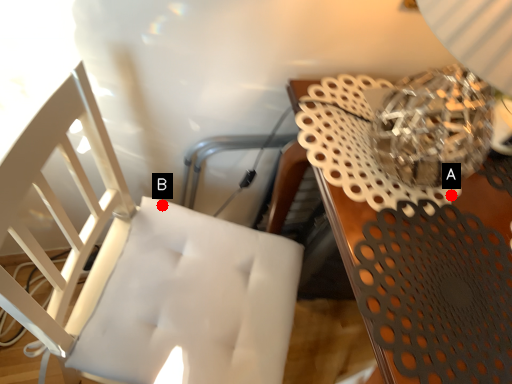
Question: Two points are circled on the image, labeled by A and B beside each circle. Which point is closer to the camera?

Choices:
 (A) A is closer
 (B) B is closer

Answer: (A)